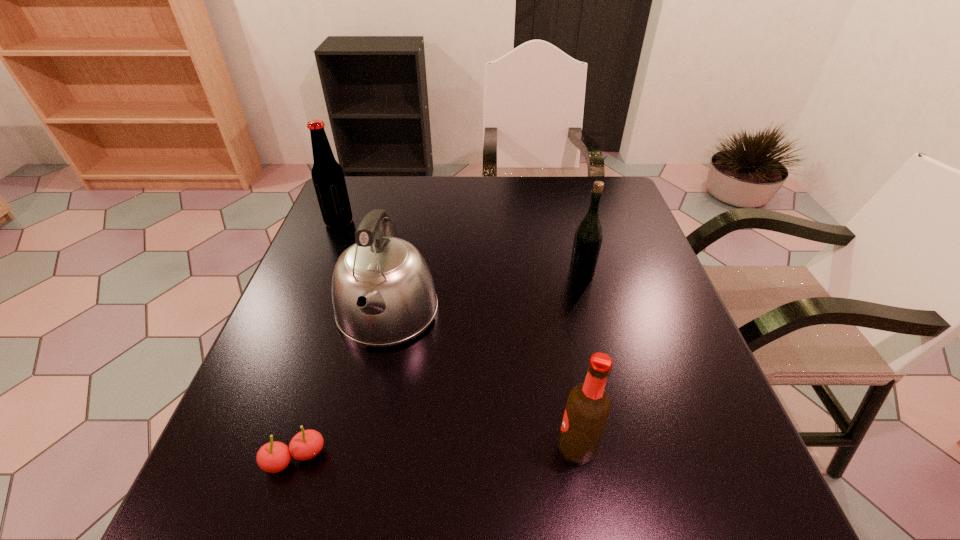
I want to click on the farthest beer bottle, so click(328, 178).

The height and width of the screenshot is (540, 960). I want to click on the leftmost beer bottle, so click(x=328, y=178).

What are the coordinates of `kettle` in the screenshot? It's located at (383, 294).

What are the coordinates of `the rightmost beer bottle` in the screenshot? It's located at (587, 242).

The height and width of the screenshot is (540, 960). I want to click on the rightmost object, so click(x=587, y=242).

Where is `the nearest beer bottle`? Image resolution: width=960 pixels, height=540 pixels. the nearest beer bottle is located at coordinates (588, 407).

Locate an element on the screen. Image resolution: width=960 pixels, height=540 pixels. the second beer bottle from right to left is located at coordinates (588, 407).

You are a GUI agent. You are given a task and a screenshot of the screen. Output one action in this format:
    pyautogui.click(x=<x>, y=<y>)
    Task: Click on the shortest object
    
    Given the screenshot: What is the action you would take?
    pyautogui.click(x=273, y=457)

Where is `free region located 0.070m on the front of the farthest beer bottle`? free region located 0.070m on the front of the farthest beer bottle is located at coordinates (329, 246).

This screenshot has height=540, width=960. What are the coordinates of `free space located 0.160m on the spout of the kettle` in the screenshot? It's located at (359, 444).